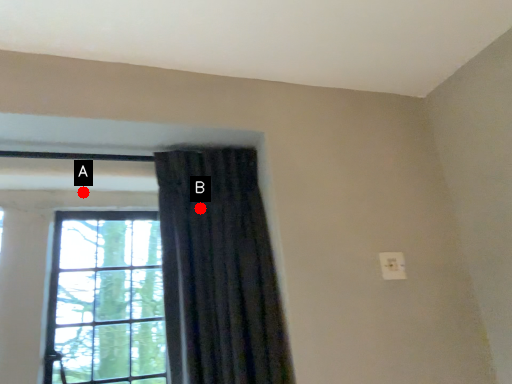
Question: Two points are circled on the image, labeled by A and B beside each circle. Which point is closer to the camera taking this photo?

Choices:
 (A) A is closer
 (B) B is closer

Answer: (B)